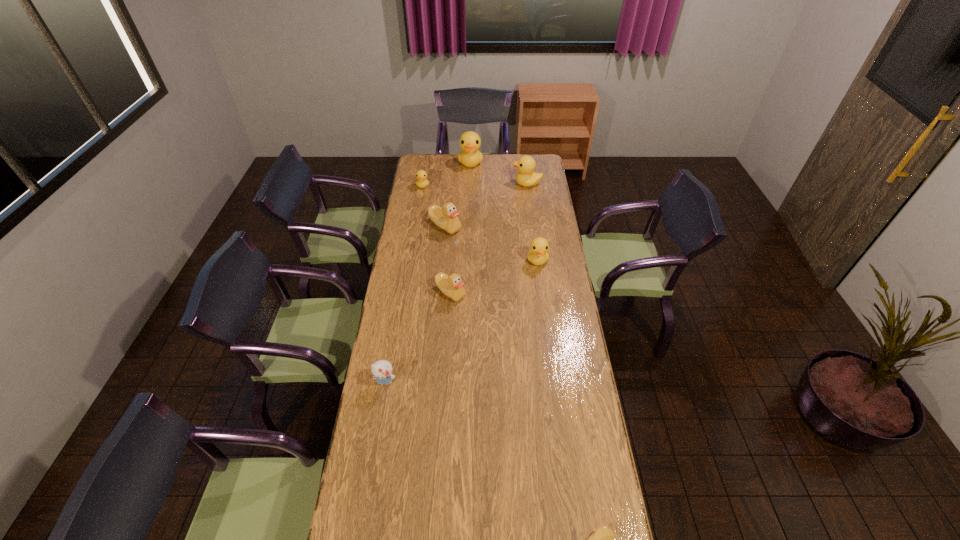
Find the location of `the smallest yellow duck`. the smallest yellow duck is located at coordinates (421, 175).

Find the location of `the leftmost yellow duck`. the leftmost yellow duck is located at coordinates (421, 175).

Where is `vacant space located 0.250m on the face of the farthest duck`? vacant space located 0.250m on the face of the farthest duck is located at coordinates (469, 196).

Locate an element on the screen. Image resolution: width=960 pixels, height=540 pixels. vacant point located on the face of the third smallest yellow duck is located at coordinates coord(461,184).

I want to click on free space located on the face of the third smallest yellow duck, so click(x=472, y=184).

In order to click on vacant area situated on the face of the third smallest yellow duck in this screenshot , I will do `click(463, 184)`.

Locate an element on the screen. Image resolution: width=960 pixels, height=540 pixels. vacant region located at the beak of the biggest beige duck is located at coordinates (444, 251).

Identify the location of free region located on the face of the fifth farthest duck. (545, 322).

I want to click on free space located 0.060m at the beak of the second nearest beige duck, so click(x=449, y=315).

This screenshot has width=960, height=540. What are the coordinates of `vacant space located on the front-facing side of the kitten` in the screenshot? It's located at (366, 491).